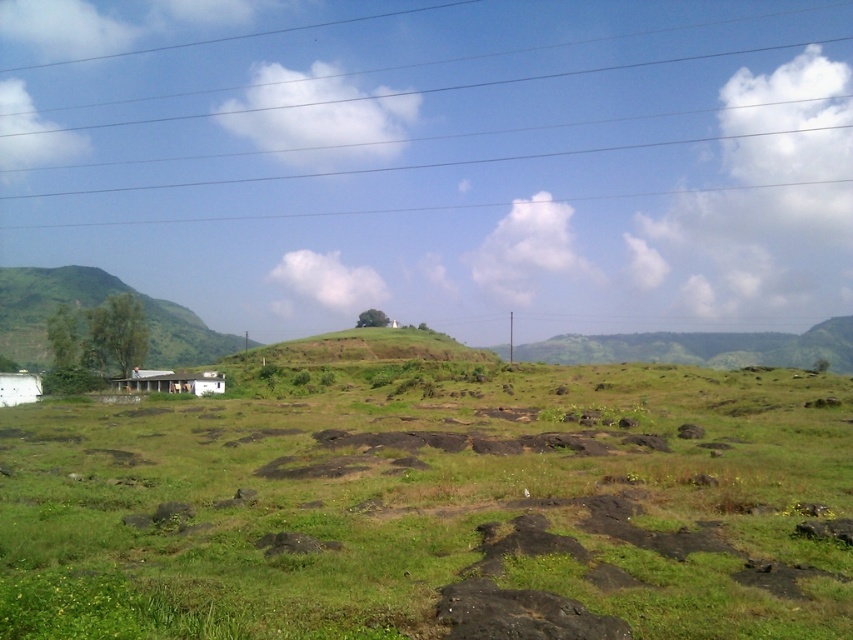
You are a hiker standing at the green grassy hillside at left and want to reach the green grassy at center. Which direction should you move to get there?

You should move to the right since the green grassy at center is to the right of the green grassy hillside at left.

You are a delivery drone that needs to land at the white wooden hut at lower left. There are metallic wires at upper center in the way. Can you safely descend without hitting the wires?

The metallic wires at upper center are positioned over the white wooden hut at lower left, so the drone should be able to descend safely by approaching from the sides or behind to avoid the wires.